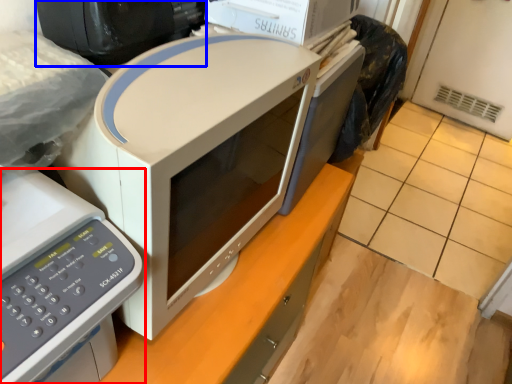
Question: Which point is further to the camera, home appliance (highlighted by a red box) or desktop computer (highlighted by a blue box)?

Choices:
 (A) home appliance
 (B) desktop computer

Answer: (B)